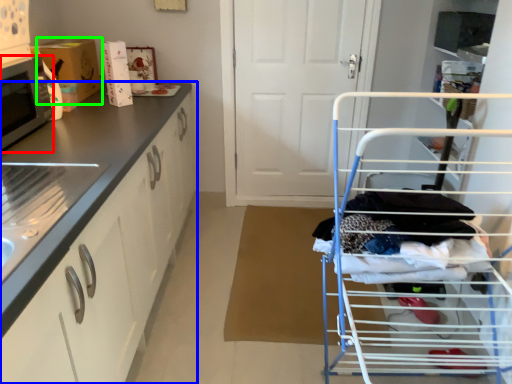
Question: Based on their relative distances, which object is nearer to microwave oven (highlighted by a red box)? Choose from cabinetry (highlighted by a blue box) and cardboard box (highlighted by a green box).

Choices:
 (A) cabinetry
 (B) cardboard box

Answer: (A)